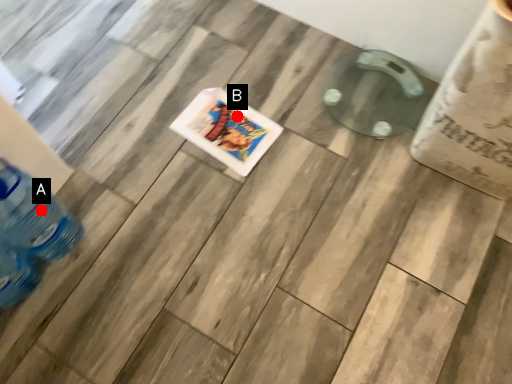
Question: Two points are circled on the image, labeled by A and B beside each circle. Which point is farther to the camera?

Choices:
 (A) A is further
 (B) B is further

Answer: (B)